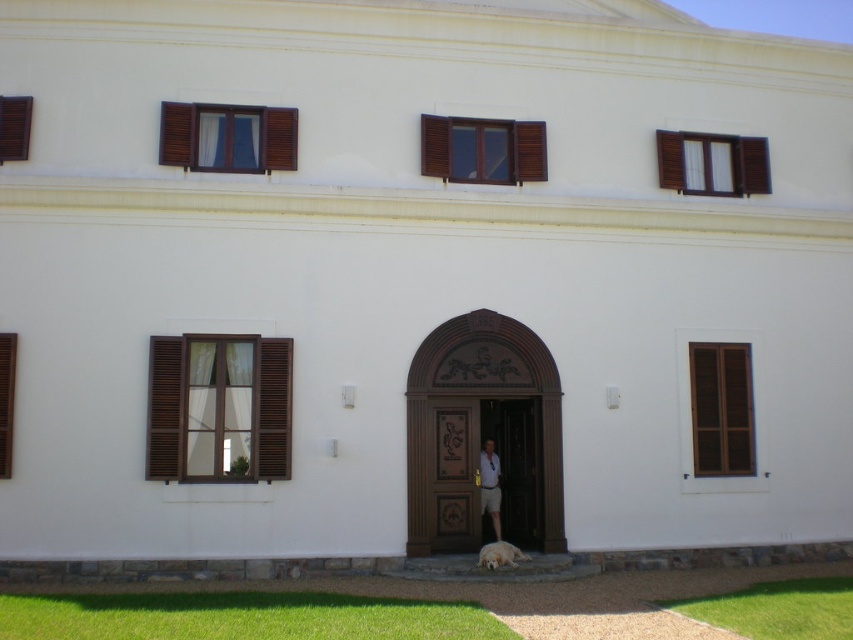
Between brown wooden shutters at upper left and wooden carved door at center, which one appears on the left side from the viewer's perspective?

brown wooden shutters at upper left is more to the left.

Does point (279, 113) lie in front of point (465, 467)?

No, (279, 113) is further to viewer.

Measure the distance between brown wooden shutters at upper left and camera.

The distance of brown wooden shutters at upper left from camera is 45.52 feet.

Identify the location of brown wooden shutters at upper left. The height and width of the screenshot is (640, 853). (227, 138).

Does brown wooden shutters at upper left have a lesser width compared to brown wooden shutter at upper left?

In fact, brown wooden shutters at upper left might be wider than brown wooden shutter at upper left.

Is brown wooden shutters at upper left to the left of brown wooden shutter at upper left from the viewer's perspective?

Incorrect, brown wooden shutters at upper left is not on the left side of brown wooden shutter at upper left.

Is point (296, 108) positioned in front of point (19, 104)?

No, it is behind (19, 104).

Image resolution: width=853 pixels, height=640 pixels. I want to click on brown wooden shutters at upper left, so click(x=227, y=138).

Describe the element at coordinates (6, 400) in the screenshot. I see `brown wooden shutter at left` at that location.

Is brown wooden shutter at left smaller than light blue shirt at center?

Indeed, brown wooden shutter at left has a smaller size compared to light blue shirt at center.

Which is in front, point (4, 346) or point (495, 520)?

Point (4, 346) is in front.

Where is `brown wooden shutter at left`? This screenshot has height=640, width=853. brown wooden shutter at left is located at coordinates (6, 400).